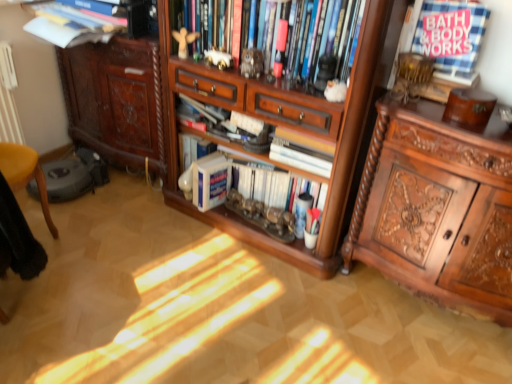
The height and width of the screenshot is (384, 512). I want to click on free location in front of brown carved cabinet at left, acting as the second cabinetry starting from the right, so click(119, 218).